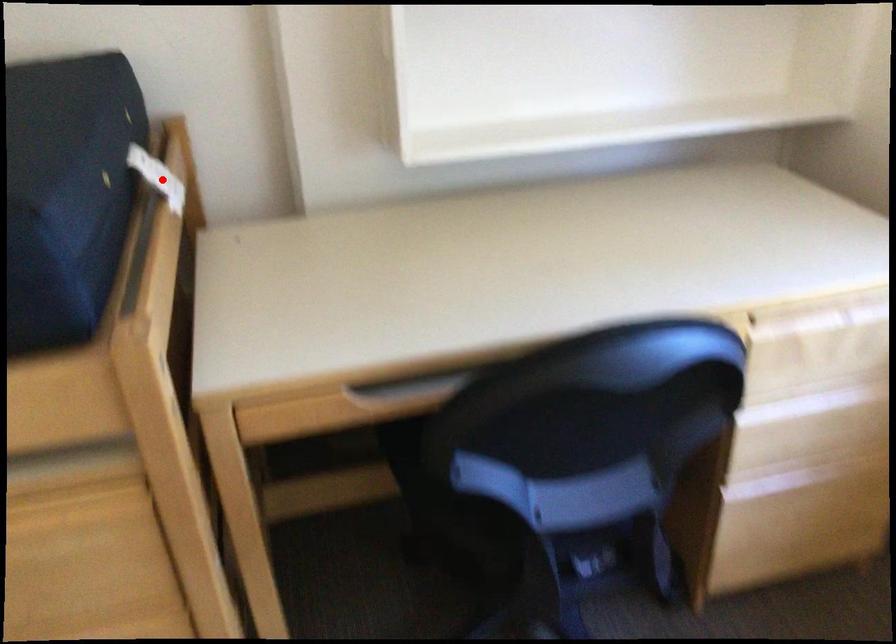
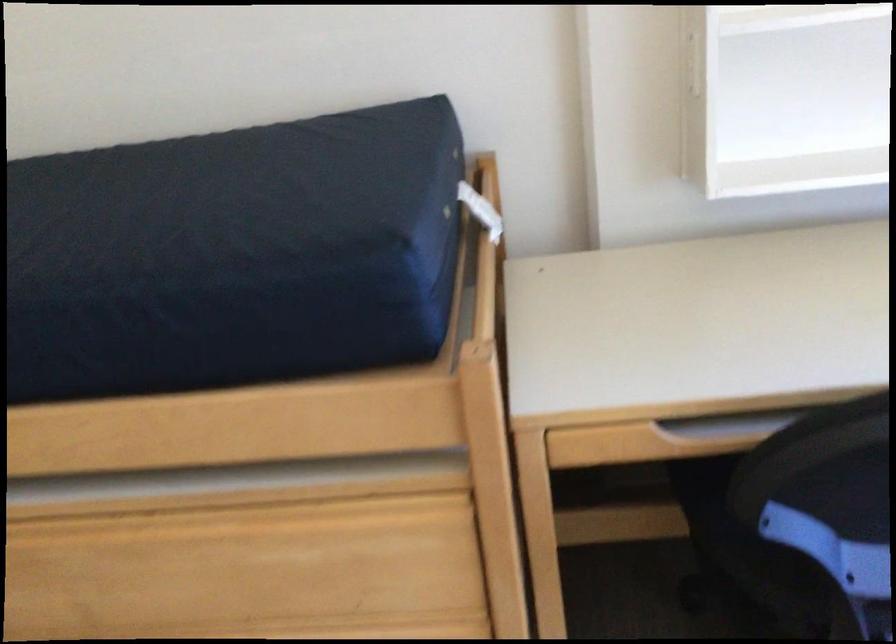
Where in the second image is the point corresponding to the highlighted location from the first image?

(480, 211)